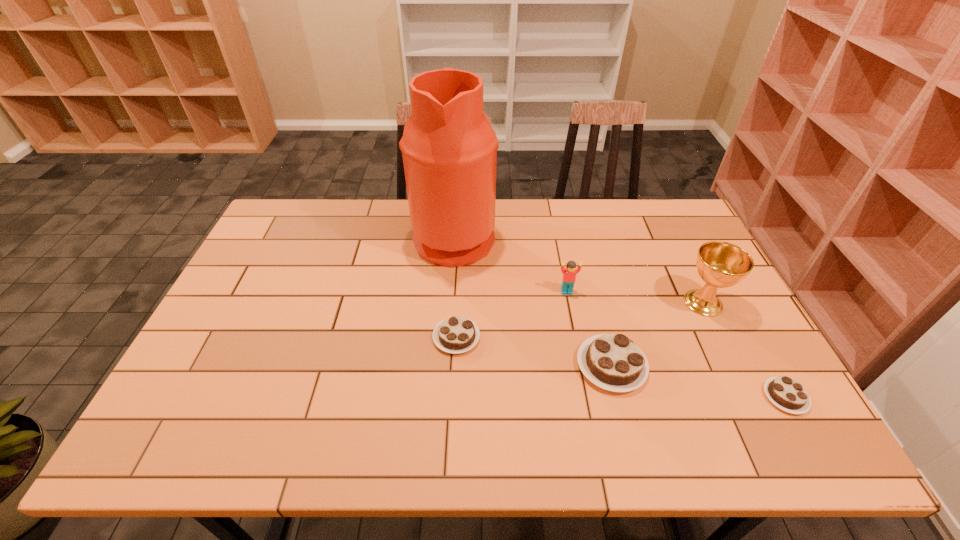
The image size is (960, 540). I want to click on free spot between the tallest object and the second chocolate cake from left to right, so click(x=533, y=301).

Identify the location of free area in between the leftmost chocolate cake and the tallest chocolate cake. The image size is (960, 540). (534, 351).

What are the coordinates of `free space between the tallest object and the second chocolate cake from left to right` in the screenshot? It's located at (533, 301).

At what (x,y) coordinates should I click in order to perform the action: click on vacant region between the tallest chocolate cake and the fourth shortest object. Please return your answer as a coordinate pair (x, y). Image resolution: width=960 pixels, height=540 pixels. Looking at the image, I should click on (589, 328).

Where is `free space between the fifth shortest object and the third shortest object`? The height and width of the screenshot is (540, 960). free space between the fifth shortest object and the third shortest object is located at coordinates (658, 334).

Locate an element on the screen. The height and width of the screenshot is (540, 960). empty space that is in between the fifth shortest object and the fifth tallest object is located at coordinates (580, 320).

At what (x,y) coordinates should I click in order to perform the action: click on the fifth closest object to the chalice. Please return your answer as a coordinate pair (x, y). The height and width of the screenshot is (540, 960). Looking at the image, I should click on (457, 334).

Identify the location of object that is the fourth closest one to the fifth tallest object. (720, 264).

Locate which chocolate cake is the closest to the farthest object. Please provide its 2D coordinates. Your answer should be formatted as a tuple, i.e. [(x, y)], where the tuple contains the x and y coordinates of a point satisfying the conditions above.

[(457, 334)]

Choose which chocolate cake is the nearest neighbor to the third tallest object. Please provide its 2D coordinates. Your answer should be formatted as a tuple, i.e. [(x, y)], where the tuple contains the x and y coordinates of a point satisfying the conditions above.

[(613, 362)]